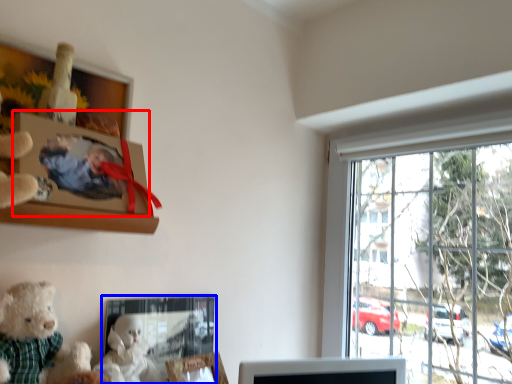
Question: Which object appears closest to the camera in this image, picture frame (highlighted by a red box) or picture frame (highlighted by a blue box)?

Choices:
 (A) picture frame
 (B) picture frame

Answer: (A)